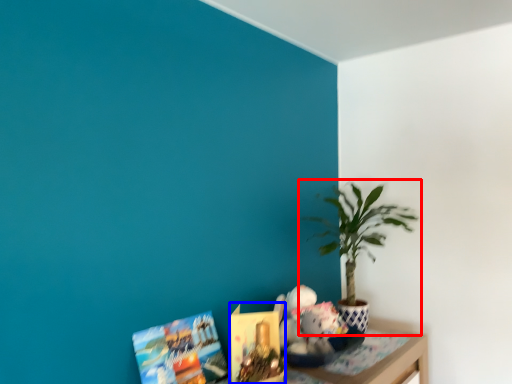
Question: Which of the following is the farthest to the observer, houseplant (highlighted by a red box) or book (highlighted by a blue box)?

Choices:
 (A) houseplant
 (B) book

Answer: (A)